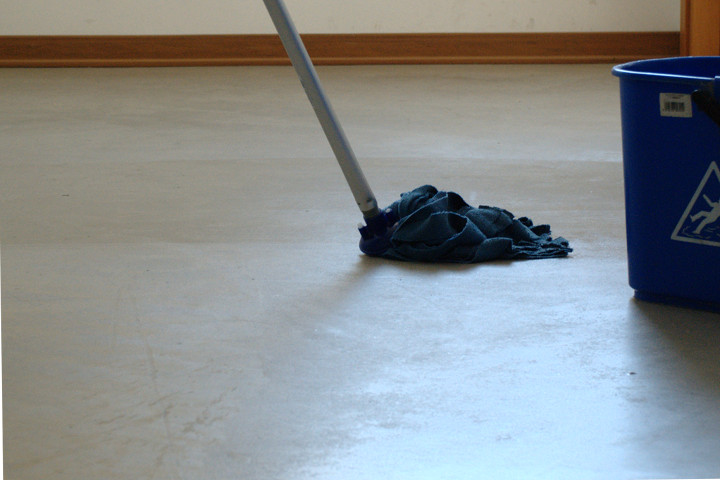
You are a GUI agent. You are given a task and a screenshot of the screen. Output one action in this format:
    pyautogui.click(x=<x>, y=<y>)
    Task: Click on the wet floor
    The width and height of the screenshot is (720, 480).
    Given the screenshot: What is the action you would take?
    pyautogui.click(x=261, y=191)